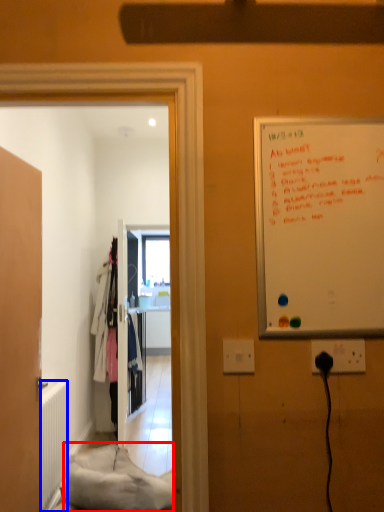
Question: Which object is closer to the camera taking this photo, material (highlighted by a red box) or radiator (highlighted by a blue box)?

Choices:
 (A) material
 (B) radiator

Answer: (A)